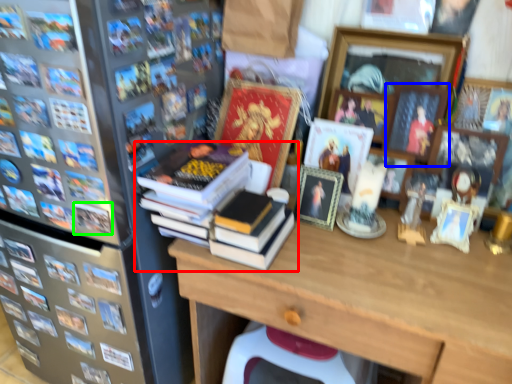
Question: Considering the real-world distances, which object is farthest from book (highlighted by a red box)? picture frame (highlighted by a blue box) or book (highlighted by a green box)?

Choices:
 (A) picture frame
 (B) book

Answer: (A)